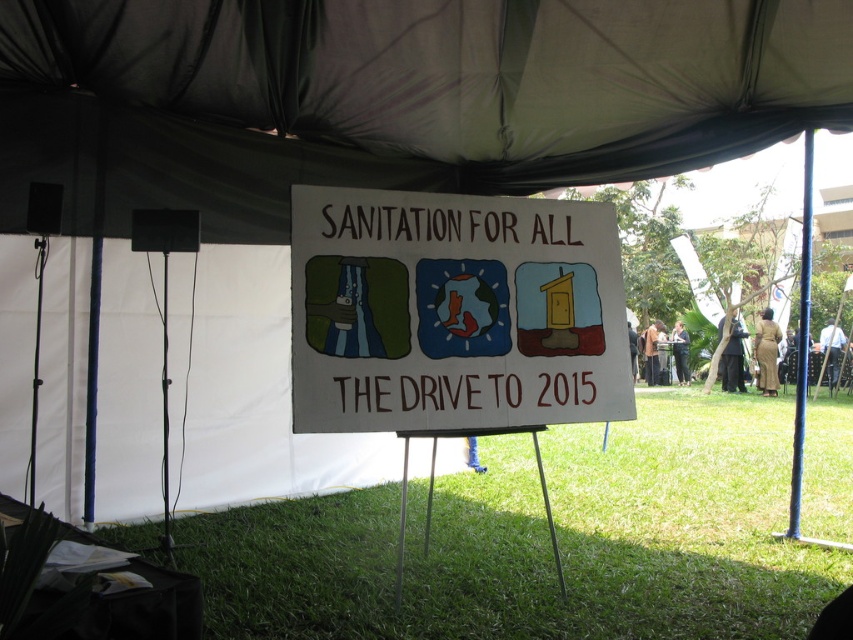
You are organizing a community event and need to place a 10cm thick promotional board between the green grass at center and the white paper sign at center. Which object should the board be placed closer to?

The board should be placed closer to the green grass at center because it is thinner than the white paper sign at center.

You are standing at the entrance of the canopy tent and see two points marked on the ground. The first point is at coordinates point (x=178, y=104) and the second is at point (x=363, y=333). Which point is closer to you?

Point (x=178, y=104) is closer to you because it is further to the viewer than point (x=363, y=333).

You are organizing a community event and need to place a new information board. You see the green grass at center and the white paper sign at center. Which object is located below the other?

The green grass at center is positioned under the white paper sign at center, so the grass is below the sign.